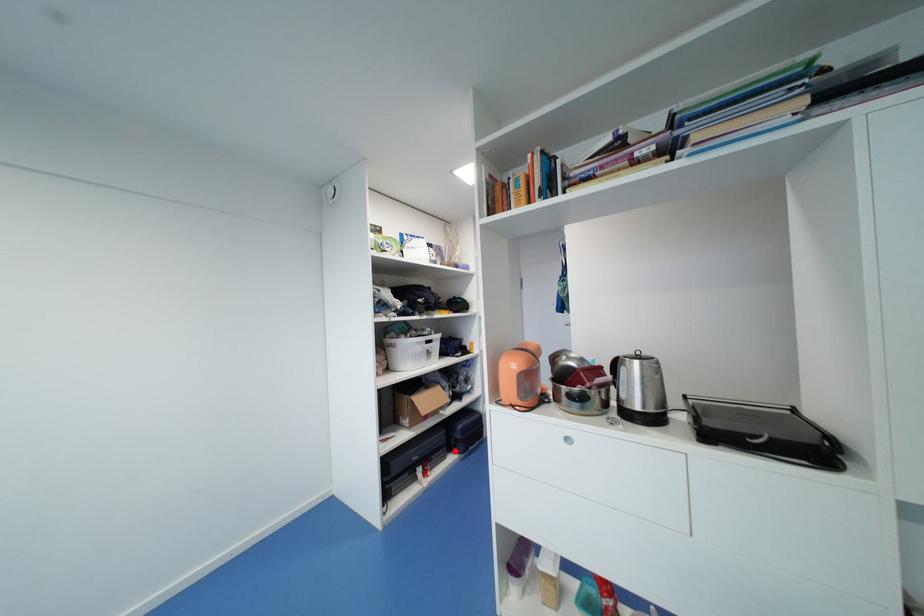
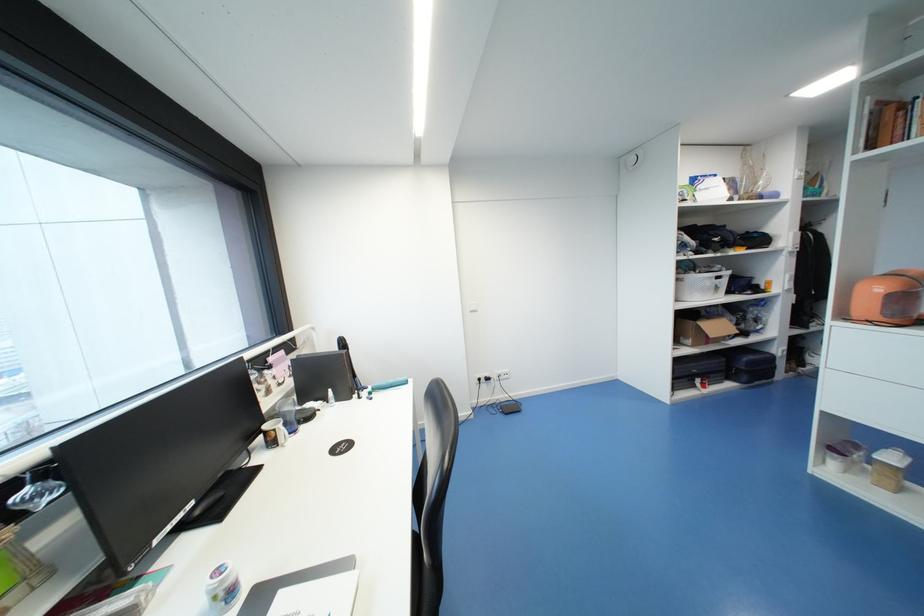
Question: I am providing you with two images of the same scene from different viewpoints. Image1 has a red point marked. In image2, the corresponding 3D location appears at what relative position? Reply with the corresponding letter.

Choices:
 (A) Closer
 (B) Farther

Answer: (A)